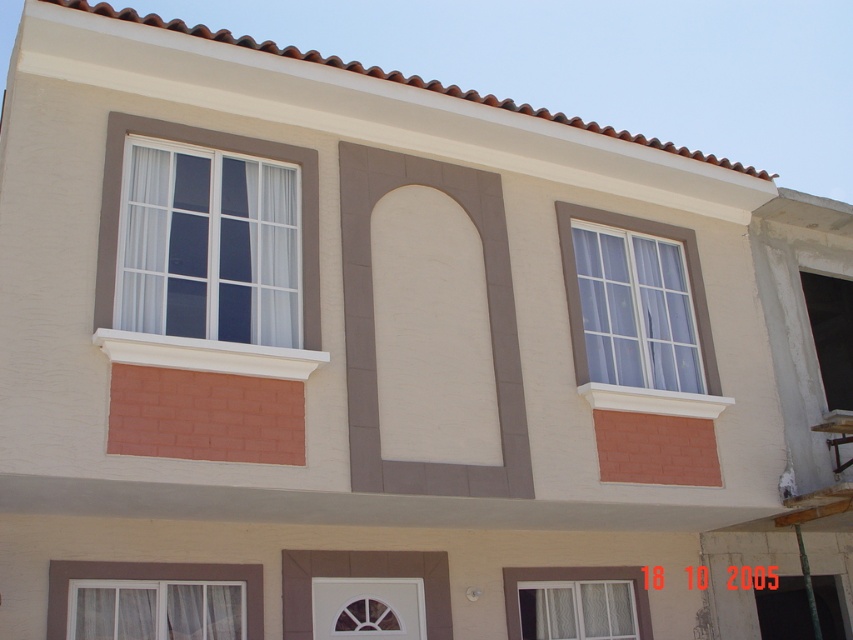
Question: Is white sheer curtain at lower left behind matte glass window at upper right?

Choices:
 (A) yes
 (B) no

Answer: (B)

Question: Which of the following is the closest to the observer?

Choices:
 (A) white glass window at upper right
 (B) white textured window at lower right

Answer: (A)

Question: Is white glass window at lower center bigger than white glass window at upper right?

Choices:
 (A) yes
 (B) no

Answer: (B)

Question: Can you confirm if white sheer curtain at lower left is positioned to the right of matte glass window at upper right?

Choices:
 (A) yes
 (B) no

Answer: (B)

Question: Which of the following is the farthest from the observer?

Choices:
 (A) white sheer curtain at lower left
 (B) white glass window at lower center

Answer: (B)

Question: Which of the following is the closest to the observer?

Choices:
 (A) (239, 632)
 (B) (222, 241)

Answer: (B)